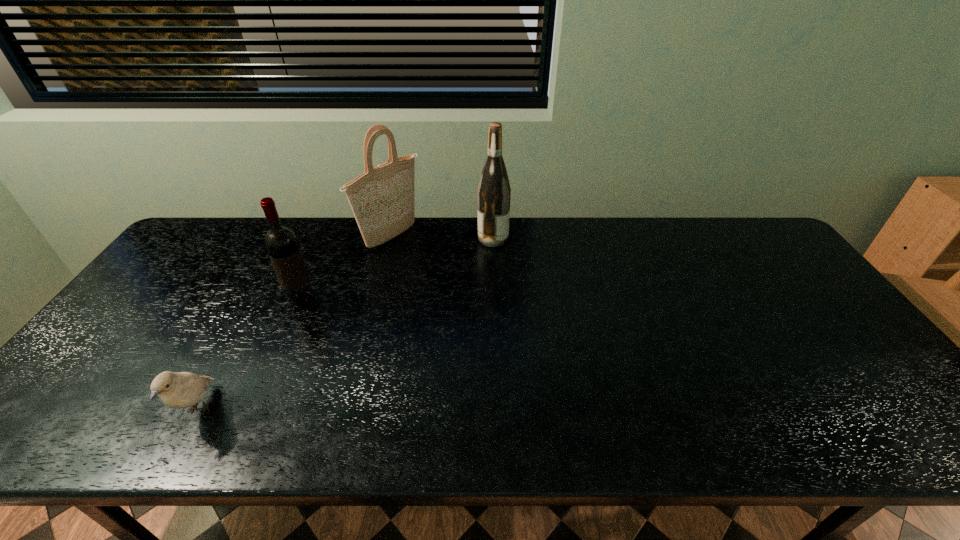
The height and width of the screenshot is (540, 960). In order to click on empty location between the third tallest object and the shopping bag in this screenshot , I will do `click(347, 269)`.

I want to click on free space that is in between the shopping bag and the nearest object, so click(x=296, y=323).

You are a GUI agent. You are given a task and a screenshot of the screen. Output one action in this format:
    pyautogui.click(x=<x>, y=<y>)
    Task: Click on the vacant space that is in between the shopping bag and the right wine bottle
    The height and width of the screenshot is (540, 960).
    Given the screenshot: What is the action you would take?
    pyautogui.click(x=443, y=238)

The width and height of the screenshot is (960, 540). Identify the location of vacant space that is in between the bird and the rightmost object. (347, 324).

Locate an element on the screen. This screenshot has width=960, height=540. free point between the third object from right to left and the rightmost object is located at coordinates (397, 269).

Where is `free space between the nearest object and the right wine bottle`? free space between the nearest object and the right wine bottle is located at coordinates (347, 324).

Find the location of `object that can be found as the closest to the second object from right to left`. object that can be found as the closest to the second object from right to left is located at coordinates (281, 243).

Image resolution: width=960 pixels, height=540 pixels. I want to click on object that stands as the second closest to the taller wine bottle, so click(x=281, y=243).